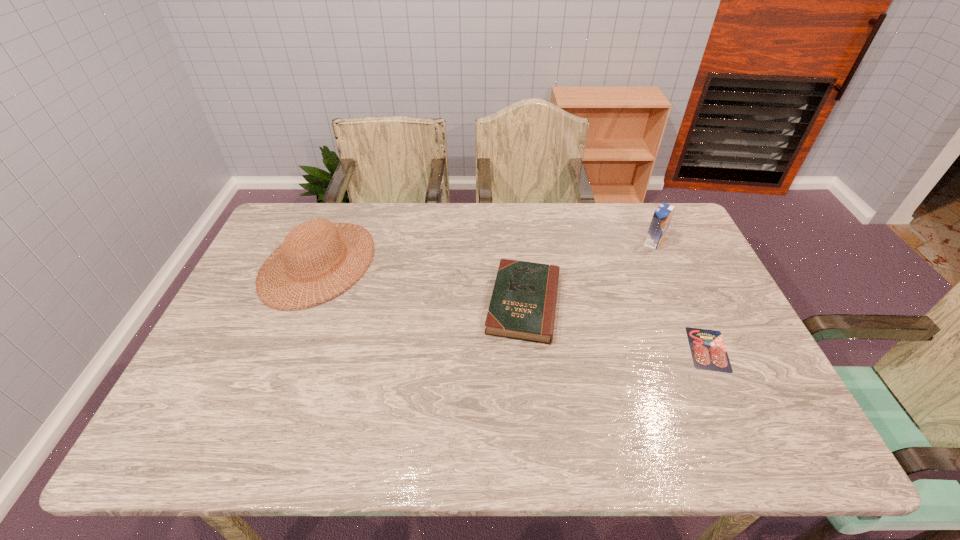
Locate an element on the screen. This screenshot has height=540, width=960. orange_juice is located at coordinates (662, 215).

Where is `the leftmost object`? Image resolution: width=960 pixels, height=540 pixels. the leftmost object is located at coordinates (298, 241).

Image resolution: width=960 pixels, height=540 pixels. Find the location of `the third shortest object`. the third shortest object is located at coordinates (298, 241).

Locate an element on the screen. the second object from left to right is located at coordinates (523, 304).

Where is `Bible`? This screenshot has height=540, width=960. Bible is located at coordinates (523, 304).

Find the location of `salami`. salami is located at coordinates (708, 351).

Where is `free space located 0.050m on the left of the orange_juice`? Image resolution: width=960 pixels, height=540 pixels. free space located 0.050m on the left of the orange_juice is located at coordinates (628, 242).

The width and height of the screenshot is (960, 540). What are the coordinates of `vacant space located on the right of the sunhat` in the screenshot? It's located at (494, 263).

The image size is (960, 540). I want to click on blank space located on the right of the third tallest object, so click(588, 303).

This screenshot has height=540, width=960. Find the location of `free space located on the left of the shortest object`. free space located on the left of the shortest object is located at coordinates (582, 349).